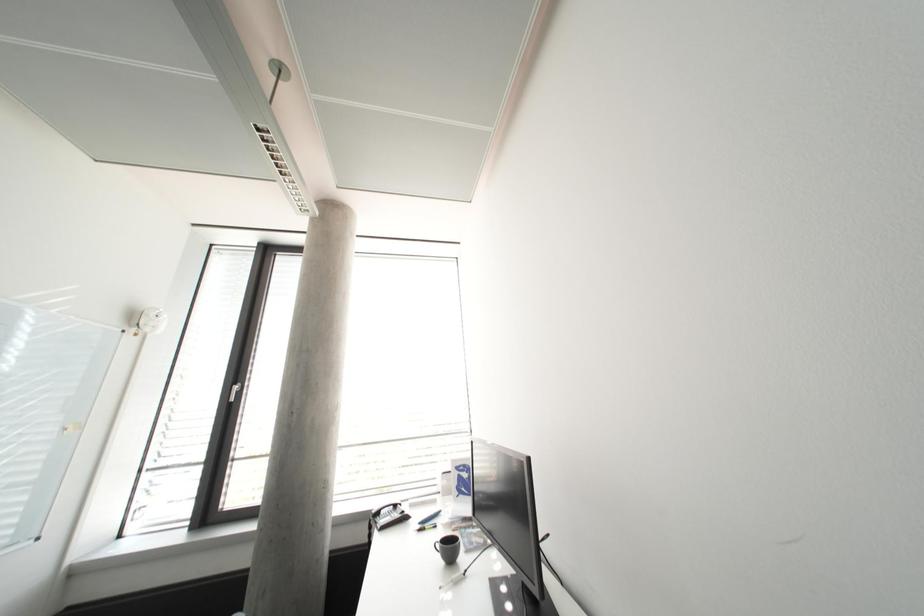
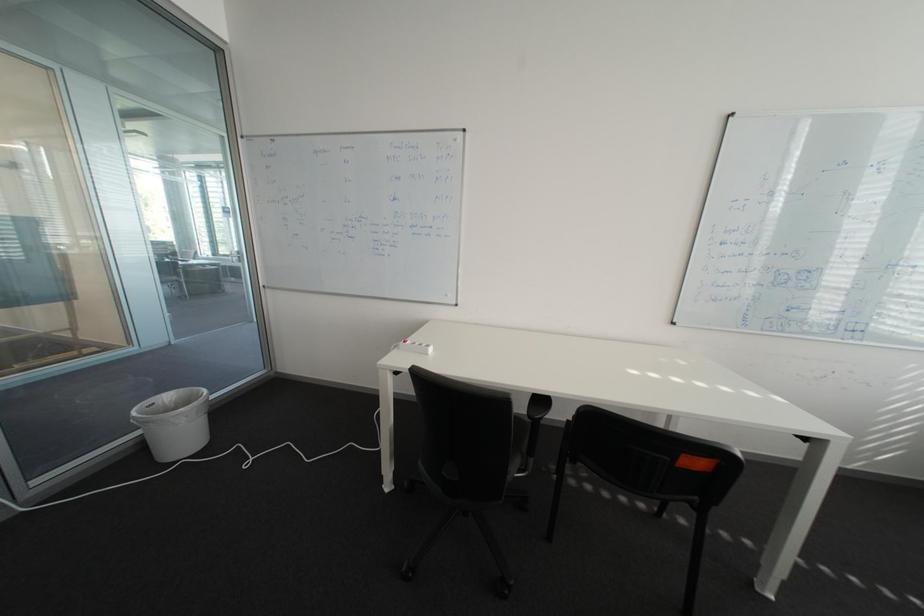
Question: The camera is either moving clockwise (left) or counter-clockwise (right) around the object. The first image is from the beginning of the video and the second image is from the end. Is the camera moving left or right when shooting the video?

Choices:
 (A) Left
 (B) Right

Answer: (B)